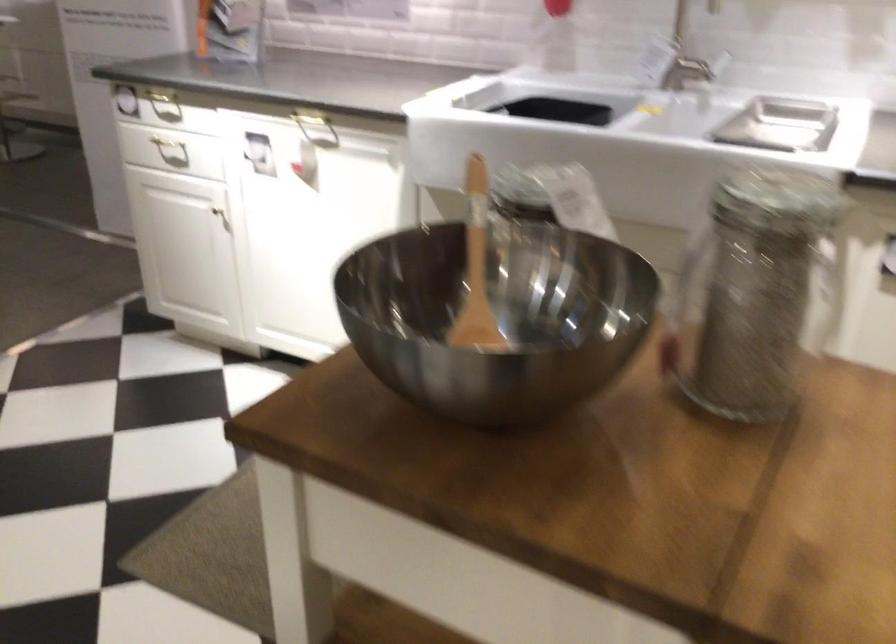
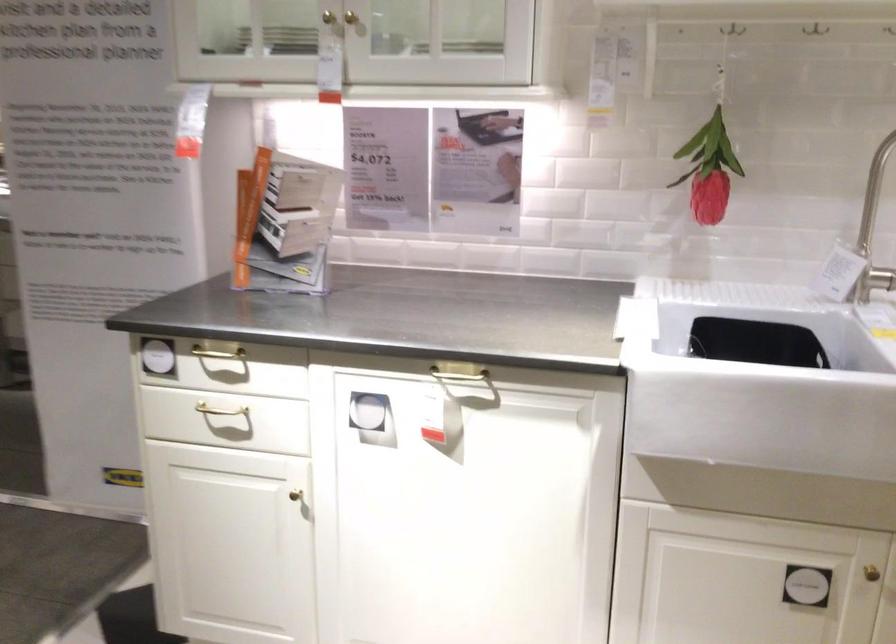
Where in the second image is the point corresponding to (x=169, y=144) from the first image?

(220, 410)